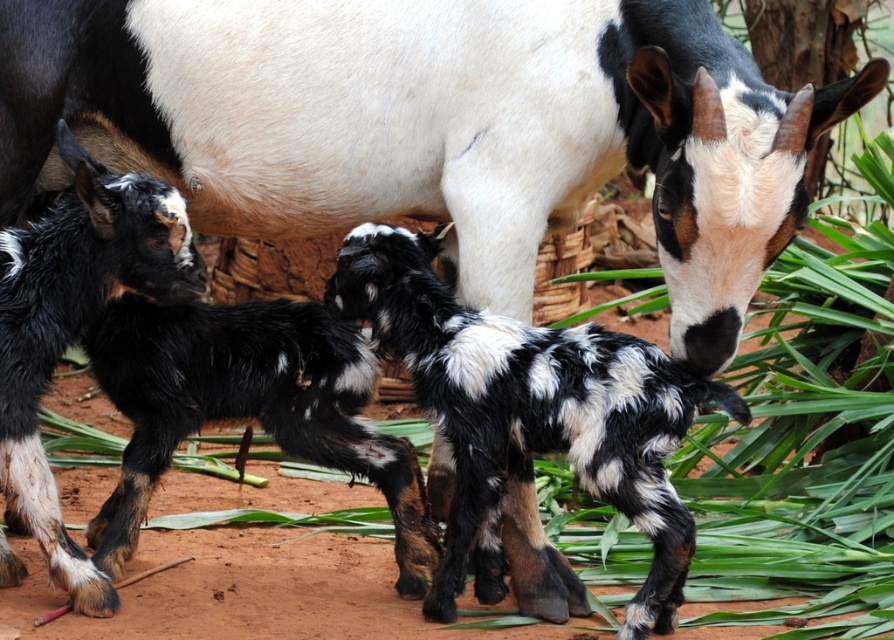
Measure the distance between spotted fur calf at center and camera.

They are 3.09 meters apart.

You are a GUI agent. You are given a task and a screenshot of the screen. Output one action in this format:
    pyautogui.click(x=<x>, y=<y>)
    Task: Click on the spotted fur calf at center
    
    Given the screenshot: What is the action you would take?
    pyautogui.click(x=529, y=416)